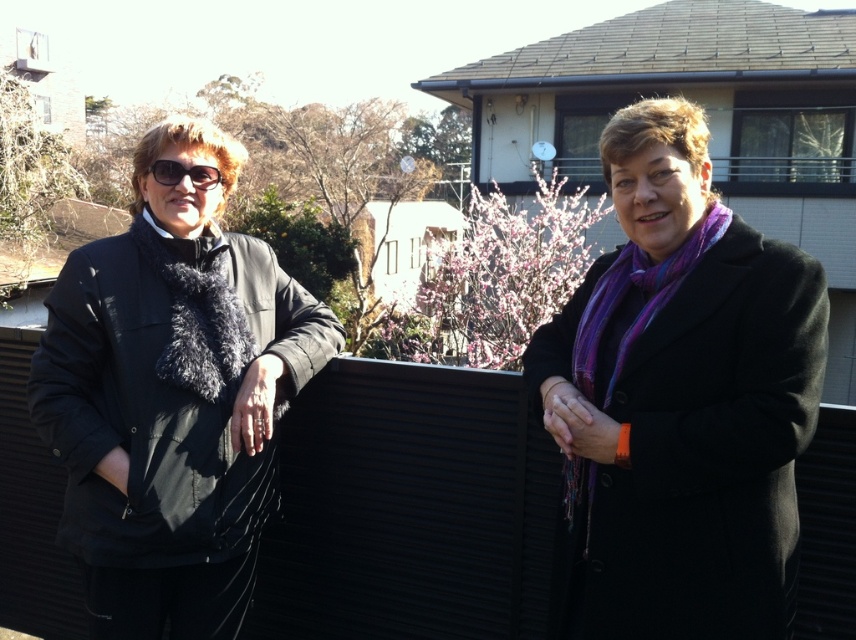
Does black fuzzy scarf at left have a lesser width compared to black matte sunglasses at left?

Incorrect, black fuzzy scarf at left's width is not less than black matte sunglasses at left's.

Is black fuzzy scarf at left positioned before black matte sunglasses at left?

Yes, black fuzzy scarf at left is in front of black matte sunglasses at left.

Locate an element on the screen. The height and width of the screenshot is (640, 856). black fuzzy scarf at left is located at coordinates (171, 397).

Which is more to the right, purple wool scarf at center or black fuzzy scarf at left?

From the viewer's perspective, purple wool scarf at center appears more on the right side.

Can you confirm if purple wool scarf at center is bigger than black fuzzy scarf at left?

No.

Find the location of `purple wool scarf at center`. purple wool scarf at center is located at coordinates (679, 403).

Which of these two, purple wool scarf at center or black matte sunglasses at left, stands taller?

Standing taller between the two is purple wool scarf at center.

Which is below, purple wool scarf at center or black matte sunglasses at left?

purple wool scarf at center is lower down.

Where is `purple wool scarf at center`? The height and width of the screenshot is (640, 856). purple wool scarf at center is located at coordinates (679, 403).

The height and width of the screenshot is (640, 856). I want to click on purple wool scarf at center, so click(679, 403).